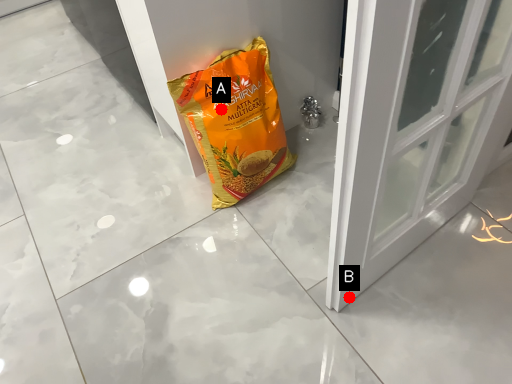
Question: Two points are circled on the image, labeled by A and B beside each circle. Which point is closer to the camera taking this photo?

Choices:
 (A) A is closer
 (B) B is closer

Answer: (B)